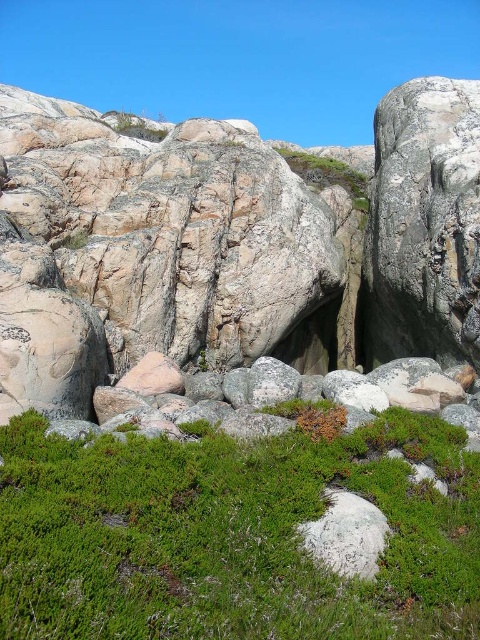
Which is below, gray/rough rock face at center or green soft grass at lower center?

green soft grass at lower center is lower down.

Is point (50, 376) closer to camera compared to point (249, 445)?

No, it is behind (249, 445).

Between point (225, 250) and point (60, 536), which one is positioned in front?

Positioned in front is point (60, 536).

In order to click on gray/rough rock face at center in this screenshot , I will do `click(231, 253)`.

Can you confirm if green soft grass at lower center is wider than smooth rock hole at center?

Yes.

In the scene shown: Between green soft grass at lower center and smooth rock hole at center, which one is positioned lower?

green soft grass at lower center

The width and height of the screenshot is (480, 640). What do you see at coordinates (231, 536) in the screenshot?
I see `green soft grass at lower center` at bounding box center [231, 536].

What are the coordinates of `green soft grass at lower center` in the screenshot? It's located at (231, 536).

Who is shorter, gray/rough rock face at center or smooth rock hole at center?

smooth rock hole at center

Which is behind, point (432, 112) or point (323, 342)?

Positioned behind is point (323, 342).

Locate an element on the screen. This screenshot has height=640, width=480. gray/rough rock face at center is located at coordinates (231, 253).

Image resolution: width=480 pixels, height=640 pixels. What are the coordinates of `gray/rough rock face at center` in the screenshot? It's located at (231, 253).